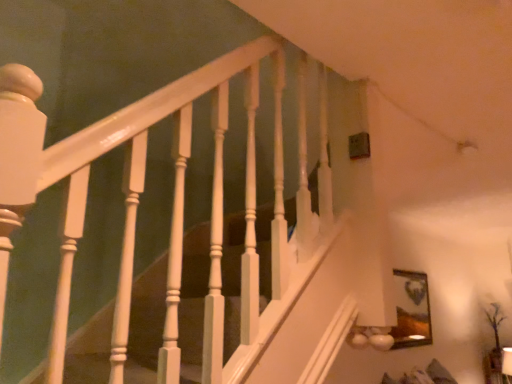
This screenshot has width=512, height=384. What do you see at coordinates (411, 310) in the screenshot?
I see `wooden framed picture at lower right` at bounding box center [411, 310].

Identify the location of wooden framed picture at lower right. [411, 310].

What is the approximate height of wooden framed picture at lower right?

It is 65.39 centimeters.

Where is `wooden framed picture at lower right`? The width and height of the screenshot is (512, 384). wooden framed picture at lower right is located at coordinates (411, 310).